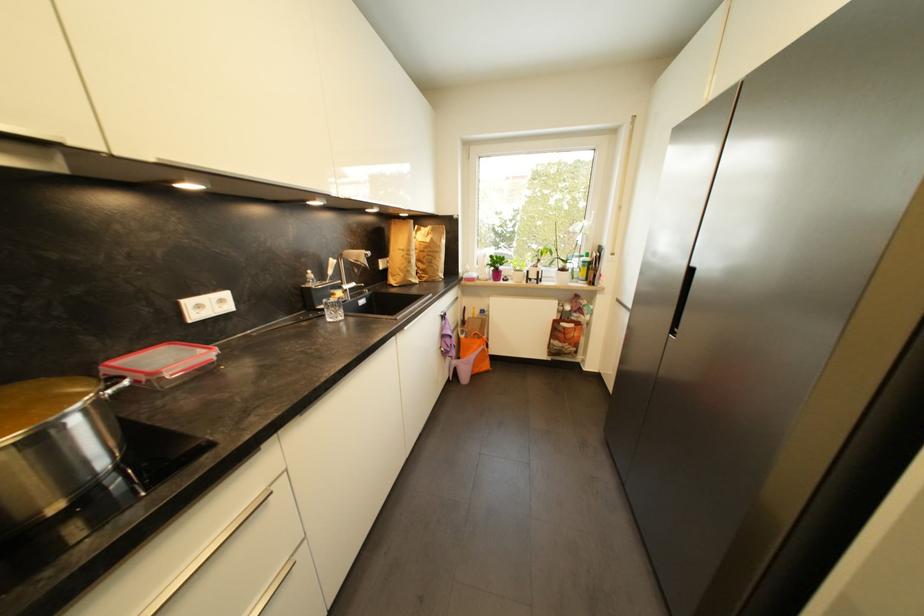
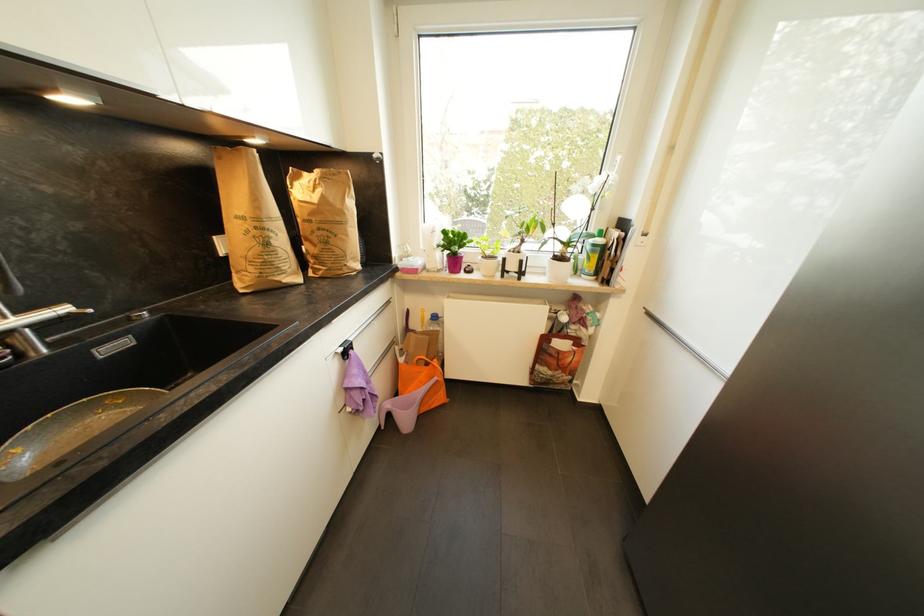
In the second image, find the point that corresponds to point (488, 314) in the first image.

(440, 320)